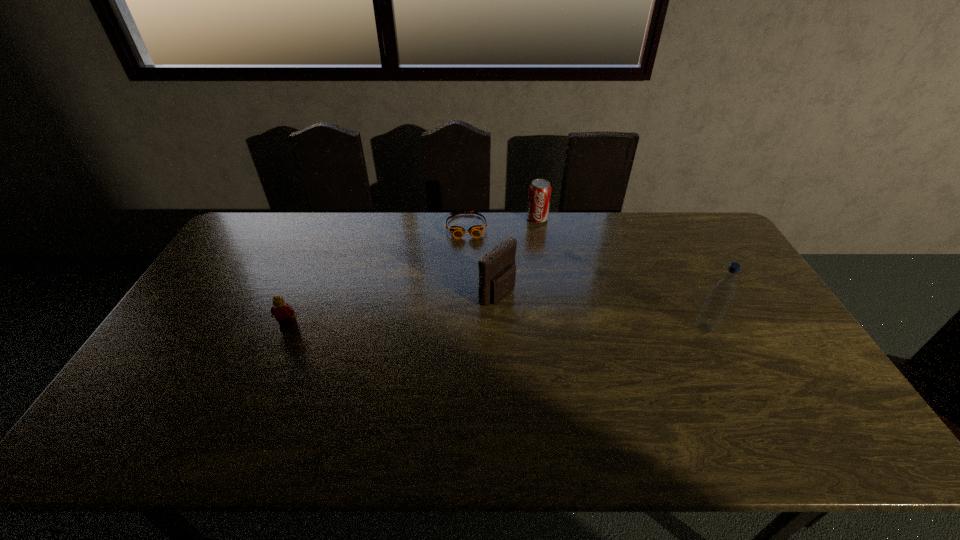
Identify which object is the third closest to the third farthest object. Please provide its 2D coordinates. Your answer should be formatted as a tuple, i.e. [(x, y)], where the tuple contains the x and y coordinates of a point satisfying the conditions above.

[(722, 291)]

Where is `free space that satisfies the following two spatial constraints: 1. on the front side of the water bottle; 2. on the left side of the shortest object`? free space that satisfies the following two spatial constraints: 1. on the front side of the water bottle; 2. on the left side of the shortest object is located at coordinates (463, 328).

Identify the location of blank space that satisfies the following two spatial constraints: 1. on the front side of the shortest object; 2. on the left side of the tallest object. (463, 328).

I want to click on free space in the image that satisfies the following two spatial constraints: 1. on the back side of the goggles; 2. on the left side of the third shortest object, so click(467, 219).